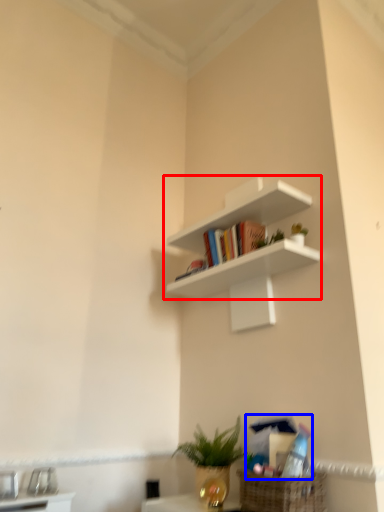
Question: Which object is further to the camera taking this photo, shelf (highlighted by a red box) or book (highlighted by a blue box)?

Choices:
 (A) shelf
 (B) book

Answer: (A)